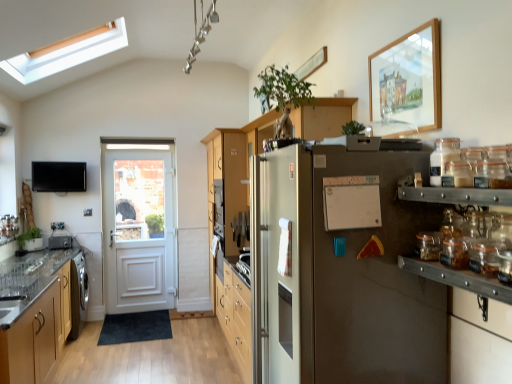
Question: Is clear glass door at left facing towards white matte bulletin board at center?

Choices:
 (A) yes
 (B) no

Answer: (A)

Question: Is clear glass door at left to the right of white matte bulletin board at center from the viewer's perspective?

Choices:
 (A) yes
 (B) no

Answer: (B)

Question: From a real-world perspective, does clear glass door at left sit lower than white matte bulletin board at center?

Choices:
 (A) no
 (B) yes

Answer: (B)

Question: From the image's perspective, is clear glass door at left on top of white matte bulletin board at center?

Choices:
 (A) yes
 (B) no

Answer: (A)

Question: Is clear glass door at left looking in the opposite direction of white matte bulletin board at center?

Choices:
 (A) yes
 (B) no

Answer: (B)

Question: From the image's perspective, is satin silver refrigerator at center located above or below clear glass jar at upper right, the 2th glass jar ordered from the bottom?

Choices:
 (A) above
 (B) below

Answer: (B)

Question: Do you think satin silver refrigerator at center is within clear glass jar at upper right, the 2th glass jar ordered from the bottom, or outside of it?

Choices:
 (A) outside
 (B) inside

Answer: (A)

Question: From a real-world perspective, is satin silver refrigerator at center physically located above or below clear glass jar at upper right, the 2th glass jar ordered from the bottom?

Choices:
 (A) above
 (B) below

Answer: (B)

Question: Relative to clear glass jar at upper right, acting as the 1th glass jar starting from the top, is satin silver refrigerator at center in front or behind?

Choices:
 (A) front
 (B) behind

Answer: (B)

Question: Considering the positions of point (57, 243) and point (24, 233), is point (57, 243) closer or farther from the camera than point (24, 233)?

Choices:
 (A) farther
 (B) closer

Answer: (A)

Question: Is metallic silver toaster at left wider or thinner than green matte plant at left?

Choices:
 (A) thin
 (B) wide

Answer: (A)

Question: From a real-world perspective, relative to green matte plant at left, is metallic silver toaster at left vertically above or below?

Choices:
 (A) above
 (B) below

Answer: (B)

Question: Is metallic silver toaster at left taller or shorter than green matte plant at left?

Choices:
 (A) tall
 (B) short

Answer: (B)

Question: From a real-world perspective, relative to clear glass door at left, is clear glass jar at right, which is counted as the 1th glass jar, starting from the bottom, vertically above or below?

Choices:
 (A) above
 (B) below

Answer: (B)

Question: From their relative heights in the image, would you say clear glass jar at right, the second glass jar in the top-to-bottom sequence, is taller or shorter than clear glass door at left?

Choices:
 (A) short
 (B) tall

Answer: (A)